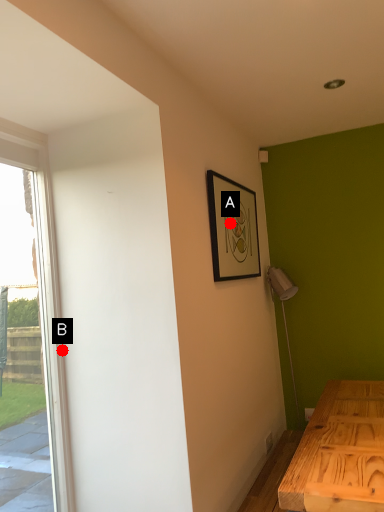
Question: Two points are circled on the image, labeled by A and B beside each circle. Which point is closer to the camera?

Choices:
 (A) A is closer
 (B) B is closer

Answer: (B)